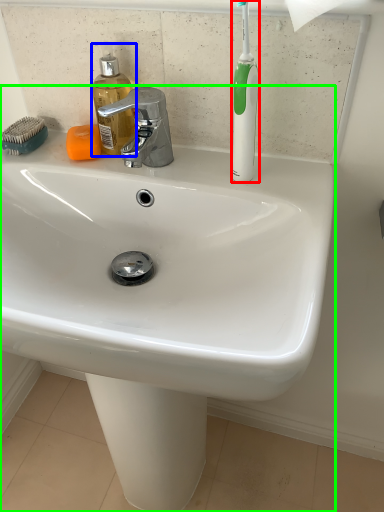
Question: Which object is positioned farthest from toothbrush (highlighted by a red box)? Select from soap dispenser (highlighted by a blue box) and sink (highlighted by a green box).

Choices:
 (A) soap dispenser
 (B) sink

Answer: (B)